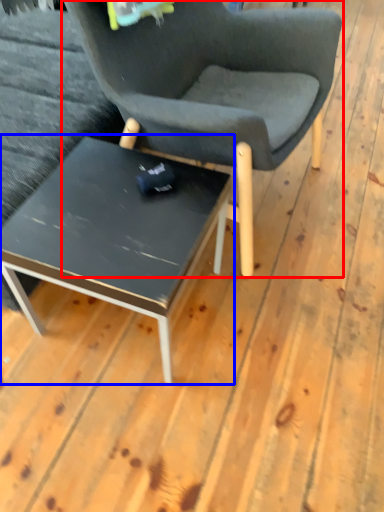
Question: Which object appears farthest to the camera in this image, chair (highlighted by a red box) or coffee table (highlighted by a blue box)?

Choices:
 (A) chair
 (B) coffee table

Answer: (B)